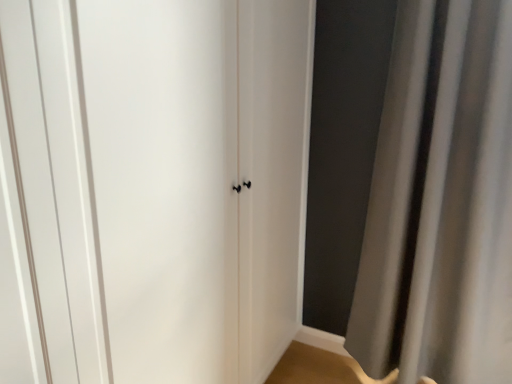
The height and width of the screenshot is (384, 512). What do you see at coordinates (152, 188) in the screenshot?
I see `white matte door at center` at bounding box center [152, 188].

Where is `white matte door at center`? white matte door at center is located at coordinates (152, 188).

The image size is (512, 384). In order to click on gray fabric curtain at right in this screenshot , I will do `click(441, 201)`.

Image resolution: width=512 pixels, height=384 pixels. Describe the element at coordinates (441, 201) in the screenshot. I see `gray fabric curtain at right` at that location.

The height and width of the screenshot is (384, 512). I want to click on white matte door at center, so (152, 188).

Visually, is gray fabric curtain at right positioned to the left or to the right of white matte door at center?

Based on their positions, gray fabric curtain at right is located to the right of white matte door at center.

Is gray fabric curtain at right positioned in front of white matte door at center?

No, it is behind white matte door at center.

Considering the positions of point (432, 51) and point (92, 317), is point (432, 51) closer or farther from the camera than point (92, 317)?

Clearly, point (432, 51) is more distant from the camera than point (92, 317).

From the image's perspective, is gray fabric curtain at right beneath white matte door at center?

No, from the image's perspective, gray fabric curtain at right is not beneath white matte door at center.

From a real-world perspective, is gray fabric curtain at right positioned above or below white matte door at center?

Clearly, from a real-world perspective, gray fabric curtain at right is below white matte door at center.

Considering the relative sizes of gray fabric curtain at right and white matte door at center in the image provided, is gray fabric curtain at right thinner than white matte door at center?

In fact, gray fabric curtain at right might be wider than white matte door at center.

Between gray fabric curtain at right and white matte door at center, which one has less height?

gray fabric curtain at right is shorter.

Which of these two, gray fabric curtain at right or white matte door at center, is smaller?

white matte door at center.

Is gray fabric curtain at right not within white matte door at center?

Absolutely, gray fabric curtain at right is external to white matte door at center.

Is gray fabric curtain at right in contact with white matte door at center?

No, gray fabric curtain at right is not making contact with white matte door at center.

Does gray fabric curtain at right turn towards white matte door at center?

No.

Find the location of a particular element. door in front of the gray fabric curtain at right is located at coordinates (152, 188).

Considering the relative positions of white matte door at center and gray fabric curtain at right in the image provided, is white matte door at center to the left of gray fabric curtain at right from the viewer's perspective?

Correct, you'll find white matte door at center to the left of gray fabric curtain at right.

From the picture: Is the depth of white matte door at center greater than that of gray fabric curtain at right?

No, white matte door at center is in front of gray fabric curtain at right.

Between point (8, 321) and point (424, 168), which one is positioned in front?

Positioned in front is point (8, 321).

From the image's perspective, which object appears higher, white matte door at center or gray fabric curtain at right?

gray fabric curtain at right is shown above in the image.

From a real-world perspective, which object stands above the other?

In real-world perspective, white matte door at center is above.

Can you confirm if white matte door at center is thinner than gray fabric curtain at right?

Correct, the width of white matte door at center is less than that of gray fabric curtain at right.

From the picture: Which of these two, white matte door at center or gray fabric curtain at right, stands taller?

With more height is white matte door at center.

Which of these two, white matte door at center or gray fabric curtain at right, is bigger?

gray fabric curtain at right is bigger.

Is white matte door at center outside of gray fabric curtain at right?

Indeed, white matte door at center is completely outside gray fabric curtain at right.

Does white matte door at center touch gray fabric curtain at right?

white matte door at center is not next to gray fabric curtain at right, and they're not touching.

Is white matte door at center looking in the opposite direction of gray fabric curtain at right?

No.

The width and height of the screenshot is (512, 384). There is a gray fabric curtain at right. What are the coordinates of `door above it (from a real-world perspective)` in the screenshot? It's located at (152, 188).

Where is `curtain beneath the white matte door at center (from a real-world perspective)`? curtain beneath the white matte door at center (from a real-world perspective) is located at coordinates (441, 201).

This screenshot has height=384, width=512. I want to click on door located above the gray fabric curtain at right (from a real-world perspective), so click(x=152, y=188).